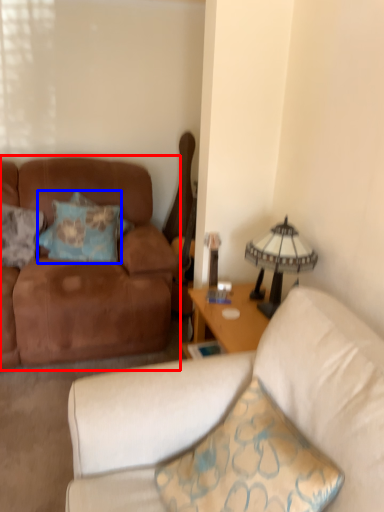
Question: Among these objects, which one is nearest to the camera, studio couch (highlighted by a red box) or pillow (highlighted by a blue box)?

Choices:
 (A) studio couch
 (B) pillow

Answer: (A)